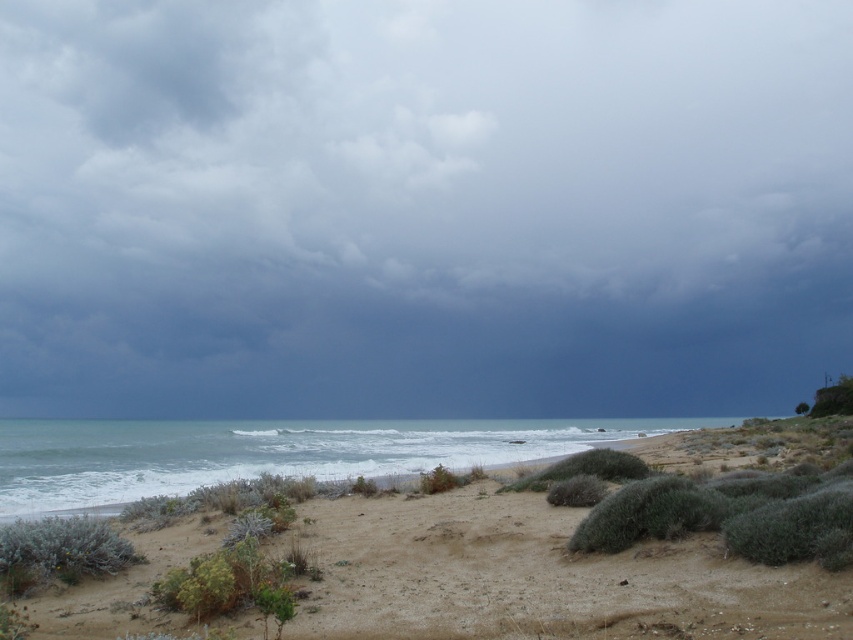
Question: Is dark gray cloud at upper center closer to camera compared to green shrub at lower left?

Choices:
 (A) yes
 (B) no

Answer: (B)

Question: Where is dark gray cloud at upper center located in relation to brown sandy beach at lower center in the image?

Choices:
 (A) right
 (B) left

Answer: (B)

Question: Estimate the real-world distances between objects in this image. Which object is closer to the blue water at lower left?

Choices:
 (A) brown sandy beach at lower center
 (B) green shrub at lower left

Answer: (A)

Question: Which object appears closest to the camera in this image?

Choices:
 (A) green shrub at lower left
 (B) brown sandy beach at lower center
 (C) blue water at lower left
 (D) dark gray cloud at upper center

Answer: (B)

Question: Is brown sandy beach at lower center positioned behind green shrub at lower left?

Choices:
 (A) no
 (B) yes

Answer: (A)

Question: Which of the following is the closest to the observer?

Choices:
 (A) (10, 582)
 (B) (432, 547)
 (C) (134, 241)
 (D) (195, 468)

Answer: (A)